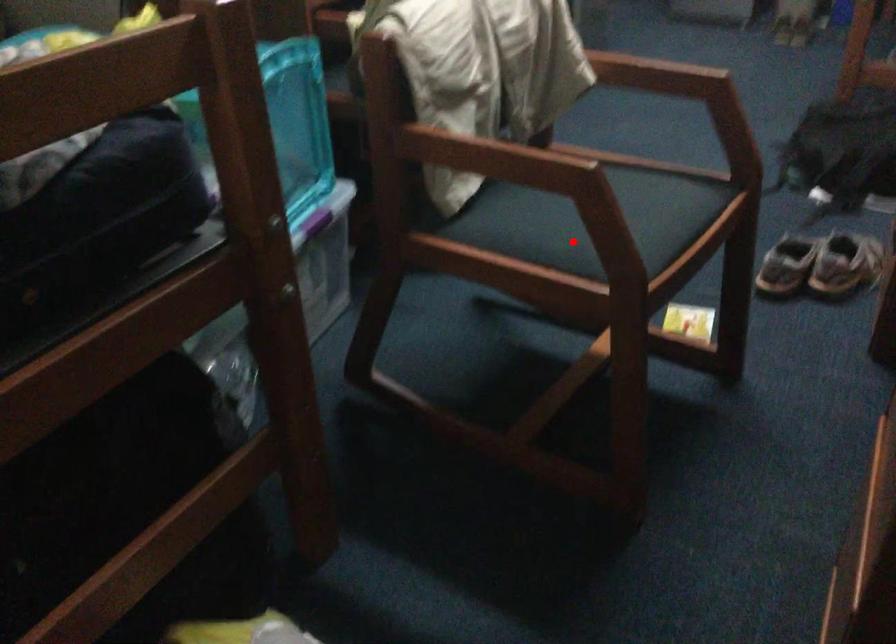
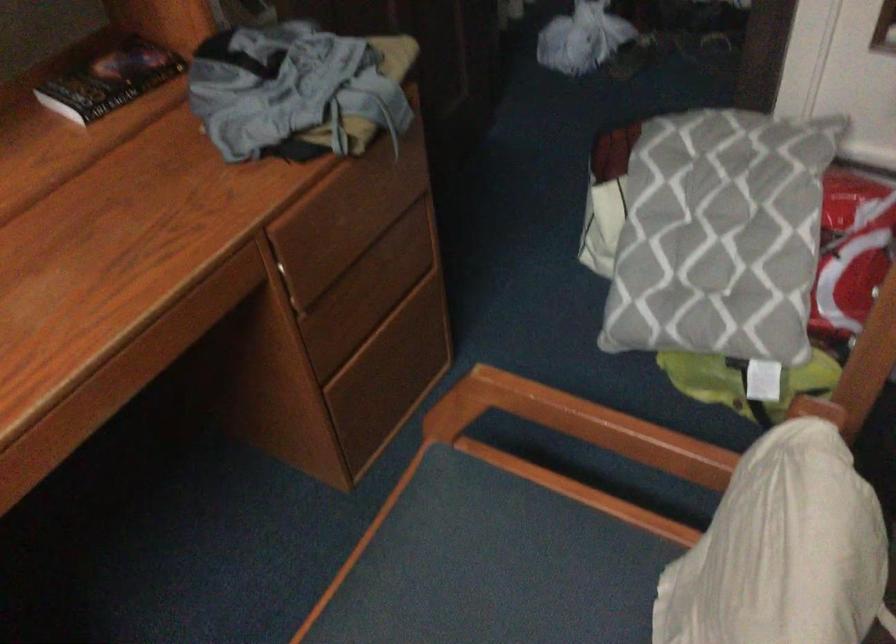
Question: I am providing you with two images of the same scene from different viewpoints. A red point is shown in image1. For the corresponding object point in image2, is it positioned nearer or farther from the camera?

Choices:
 (A) Nearer
 (B) Farther

Answer: (A)